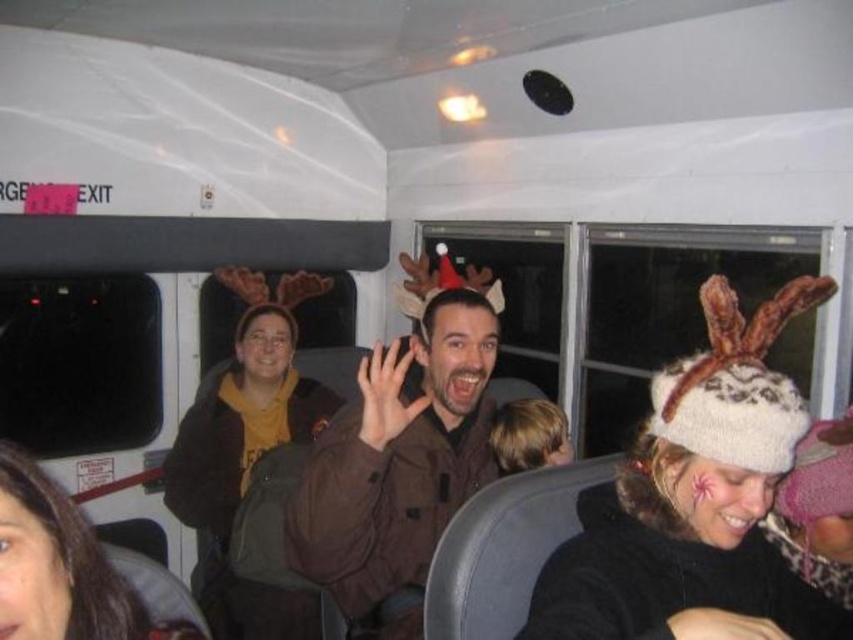
Is brown matte jacket at center above brown fuzzy jacket at center?

Yes, brown matte jacket at center is above brown fuzzy jacket at center.

Who is more distant from viewer, (401, 440) or (252, 312)?

Positioned behind is point (252, 312).

Measure the distance between point (488,364) and camera.

A distance of 1.84 meters exists between point (488,364) and camera.

Find the location of `brown matte jacket at center`. brown matte jacket at center is located at coordinates (x=398, y=458).